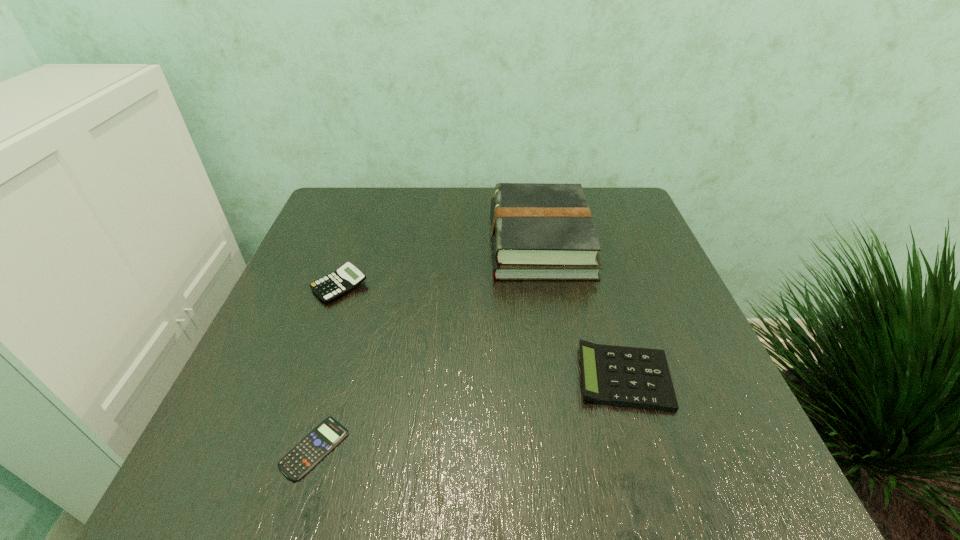
Where is `vacant space that's between the shortest object and the farthest calculator`? vacant space that's between the shortest object and the farthest calculator is located at coordinates coord(327,367).

Find the location of a particular element. The width and height of the screenshot is (960, 540). empty space between the nearest calculator and the tallest object is located at coordinates (427, 345).

You are a GUI agent. You are given a task and a screenshot of the screen. Output one action in this format:
    pyautogui.click(x=<x>, y=<y>)
    Task: Click on the vacant space that is in between the shortest calculator and the farthest calculator
    This screenshot has width=960, height=540.
    Given the screenshot: What is the action you would take?
    pyautogui.click(x=327, y=367)

I want to click on blank region between the nearest object and the farthest calculator, so click(327, 367).

Where is `empty location between the farthest calculator and the second nearest calculator`? empty location between the farthest calculator and the second nearest calculator is located at coordinates (482, 332).

This screenshot has width=960, height=540. I want to click on vacant area that lies between the tallest object and the third farthest object, so 582,309.

Identify which object is located as the third nearest to the second nearest calculator. Please provide its 2D coordinates. Your answer should be formatted as a tuple, i.e. [(x, y)], where the tuple contains the x and y coordinates of a point satisfying the conditions above.

[(348, 277)]

Where is `object that can be found as the third closest to the nearest calculator`? This screenshot has height=540, width=960. object that can be found as the third closest to the nearest calculator is located at coordinates (539, 231).

Find the location of a particular element. the second closest calculator to the farthest calculator is located at coordinates (634, 377).

Locate which calculator is the closest to the farthest calculator. Please provide its 2D coordinates. Your answer should be formatted as a tuple, i.e. [(x, y)], where the tuple contains the x and y coordinates of a point satisfying the conditions above.

[(307, 453)]